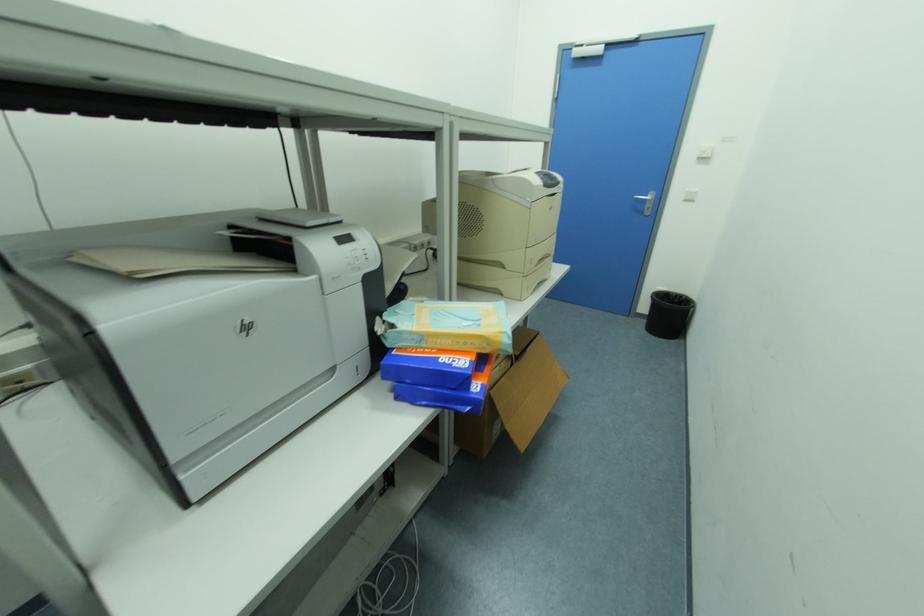
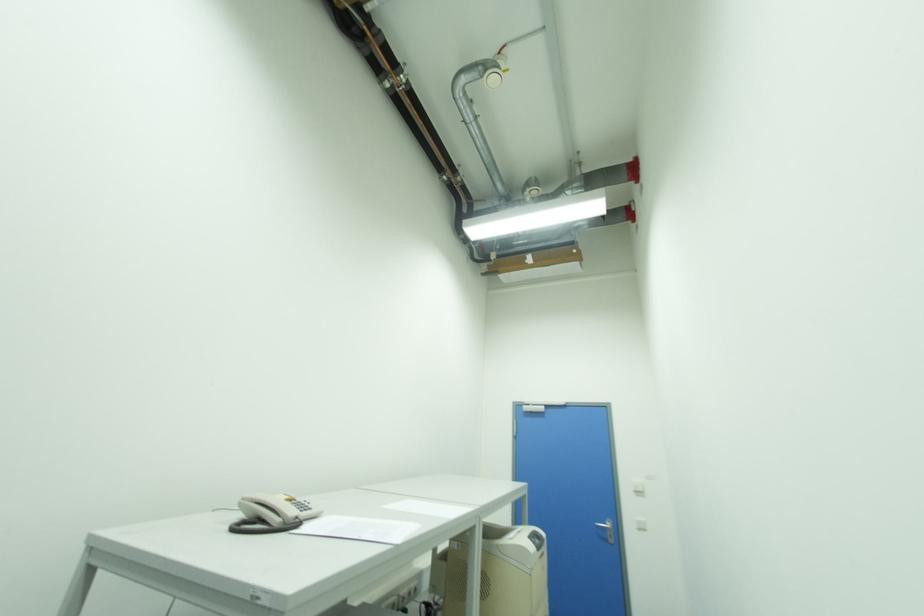
Question: Based on the continuous images, in which direction is the camera rotating? Reply with the corresponding letter.

Choices:
 (A) Left
 (B) Right
 (C) Up
 (D) Down

Answer: (C)